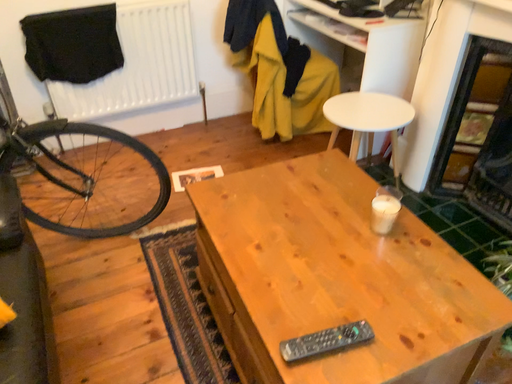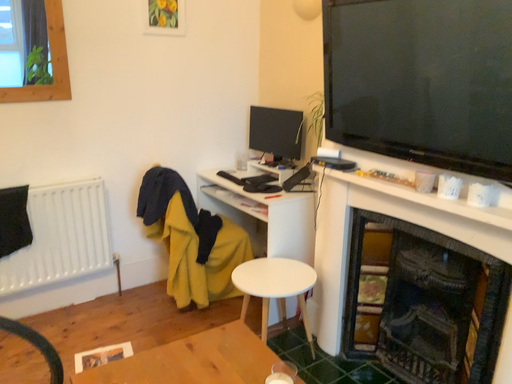
Question: Which way did the camera rotate in the video?

Choices:
 (A) rotated downward
 (B) rotated upward

Answer: (B)